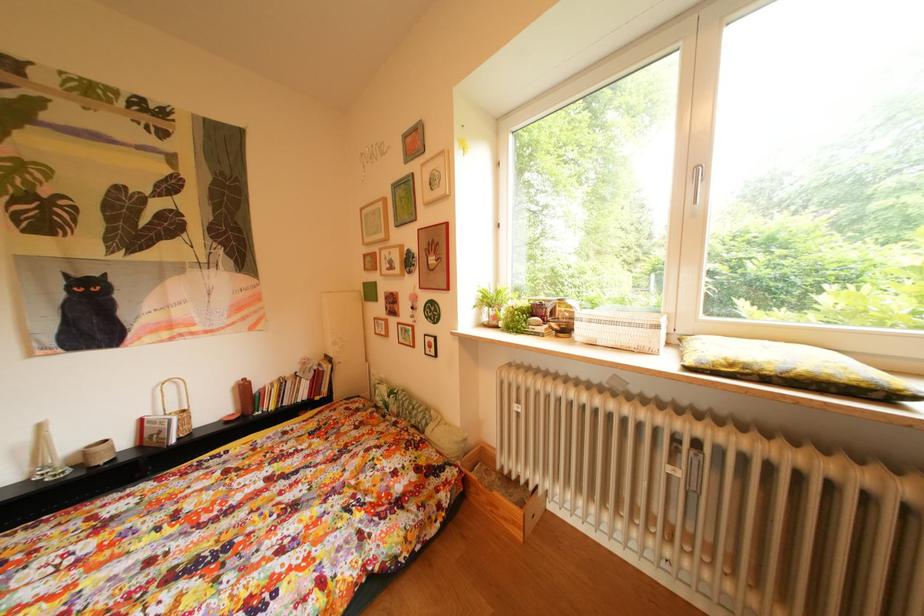
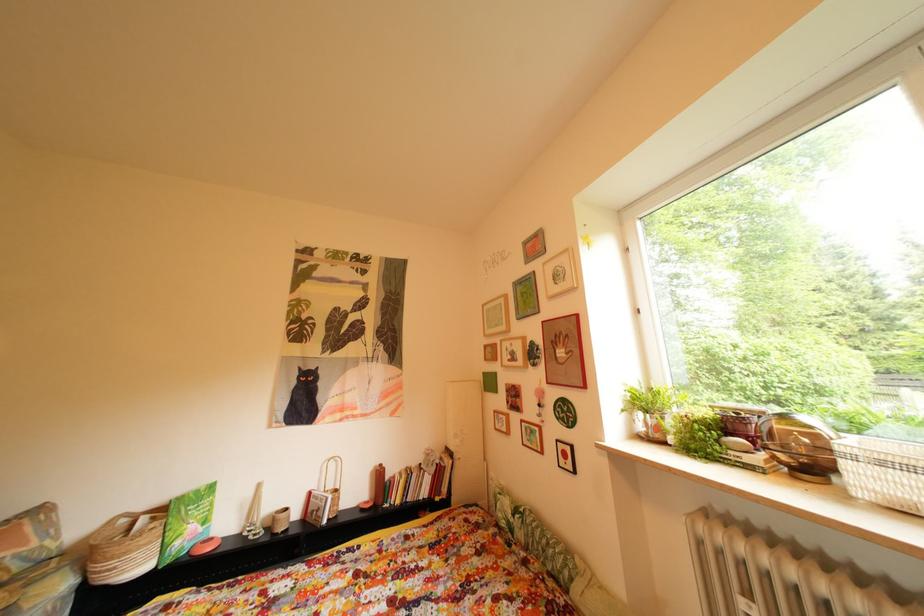
Question: In a continuous first-person perspective shot, in which direction is the camera moving?

Choices:
 (A) Left
 (B) Right
 (C) Forward
 (D) Backward

Answer: (A)